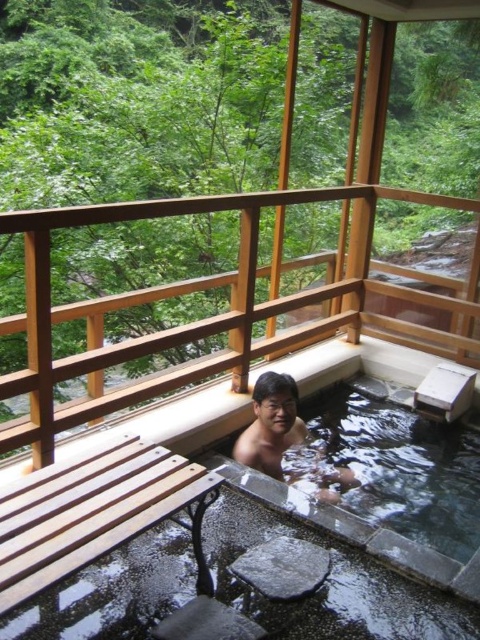
You are a guest at the ryokan and want to take a photo of the clear water at tub center and the smooth skin man at center. Which object should you focus on first if you want to capture both in a single shot without moving the camera?

The clear water at tub center is taller than the smooth skin man at center, so you should focus on the smooth skin man at center first to ensure both are in frame.

You are a guest at the ryokan and want to sit on the wooden at center while keeping your feet in the clear water at tub center. Is this possible?

The wooden at center is taller than clear water at tub center, so yes, you can sit on the wooden at center and keep your feet in the clear water at tub center since the wooden platform is elevated above the water level.

You are a guest staying at the ryokan and want to enter the hot spring. There is a wooden at center and a smooth skin man at center in your way. Which object do you need to step over to access the hot spring?

You need to step over the wooden at center because it is positioned over the smooth skin man at center, meaning the wooden structure is in your path towards the hot spring.